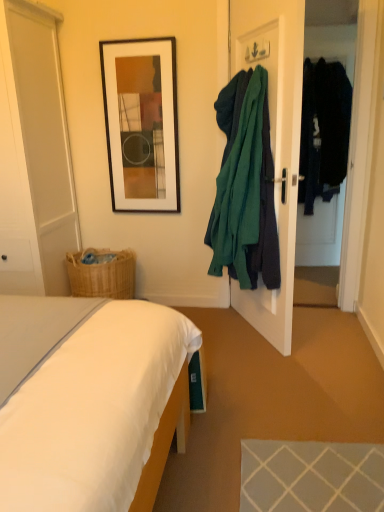
The width and height of the screenshot is (384, 512). Find the location of `free space in front of teal fabric coat hanger at right`. free space in front of teal fabric coat hanger at right is located at coordinates (247, 368).